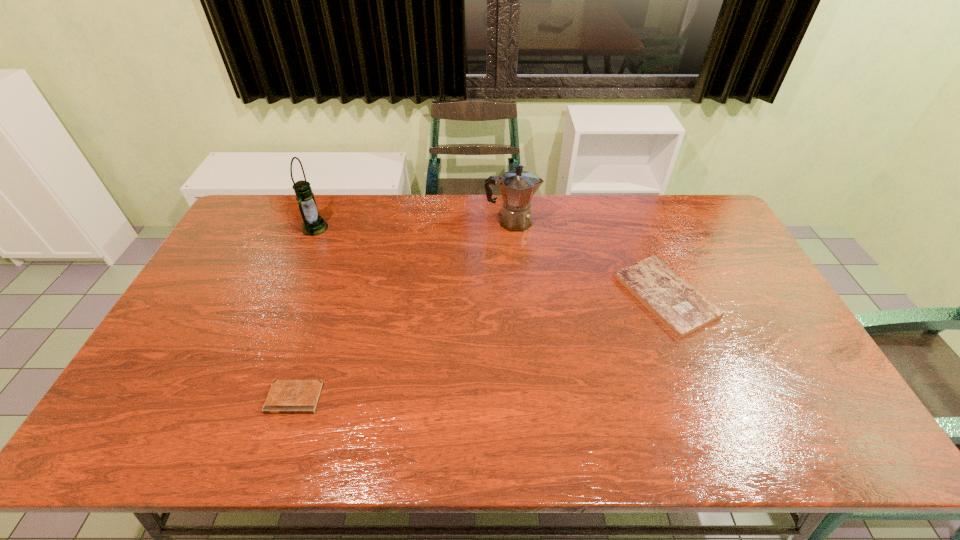
Image resolution: width=960 pixels, height=540 pixels. I want to click on vacant space that's between the second shortest object and the tallest object, so click(490, 261).

What are the coordinates of `vacant point located between the third object from left to right and the tallest object` in the screenshot? It's located at (414, 225).

The image size is (960, 540). I want to click on free area in between the tallest object and the second object from right to left, so click(414, 225).

The height and width of the screenshot is (540, 960). In order to click on vacant space in between the shortest object and the rightmost object in this screenshot , I will do pos(480,347).

You are a GUI agent. You are given a task and a screenshot of the screen. Output one action in this format:
    pyautogui.click(x=<x>, y=<y>)
    Task: Click on the unoccupied position between the nearest object and the coffeepot
    This screenshot has width=960, height=540.
    Given the screenshot: What is the action you would take?
    (403, 310)

The width and height of the screenshot is (960, 540). In order to click on free area in between the leftmost object and the third object from right to left in this screenshot , I will do `click(304, 313)`.

The height and width of the screenshot is (540, 960). Find the location of `free area in between the second object from left to right and the leftmost object`. free area in between the second object from left to right and the leftmost object is located at coordinates (304, 313).

In order to click on unoccupied area between the third object from left to right and the lantern in this screenshot , I will do coord(414,225).

What are the coordinates of `vacant space in between the second shortest object and the third object from right to left` in the screenshot? It's located at 480,347.

What are the coordinates of `the third closest object to the diary` in the screenshot? It's located at pyautogui.click(x=679, y=306).